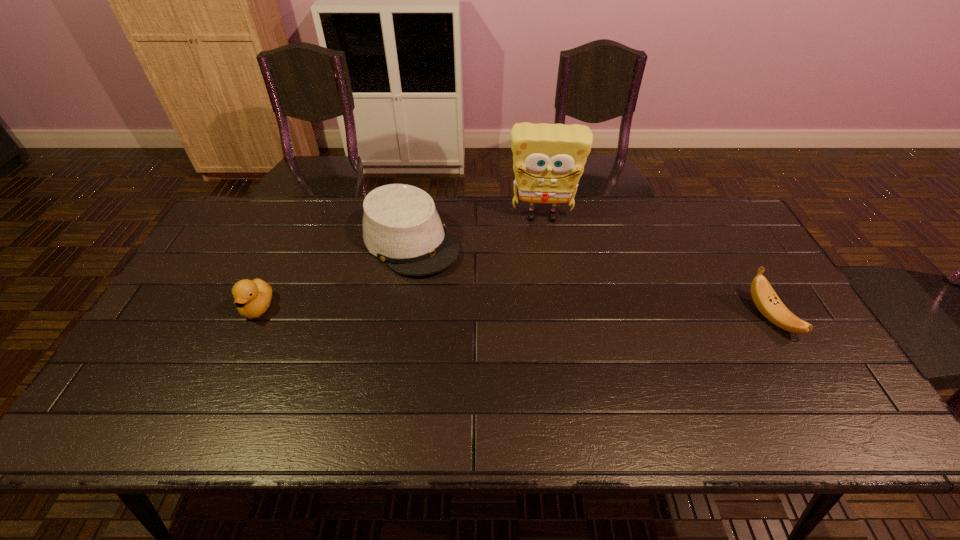
Locate an element on the screen. The width and height of the screenshot is (960, 540). free region at the near left corner of the desktop is located at coordinates (178, 375).

Find the location of a particular element. vacant space at the far right corner of the desktop is located at coordinates (730, 209).

Where is `free space between the hat and the duckling`? This screenshot has width=960, height=540. free space between the hat and the duckling is located at coordinates (334, 275).

I want to click on empty space between the rightmost object and the duckling, so click(x=514, y=313).

This screenshot has width=960, height=540. Identify the location of vacant area that lies between the duckling and the third object from right to left. (334, 275).

You are a GUI agent. You are given a task and a screenshot of the screen. Output one action in this format:
    pyautogui.click(x=<x>, y=<y>)
    Task: Click on the empty space between the third object from right to left and the rightmost object
    This screenshot has height=540, width=960.
    Given the screenshot: What is the action you would take?
    pyautogui.click(x=590, y=280)

Find the location of a particular element. Image resolution: width=960 pixels, height=540 pixels. vacant area between the banana and the second object from left to right is located at coordinates (590, 280).

Locate an element on the screen. vacant point located between the hat and the banana is located at coordinates (590, 280).

I want to click on free point between the rightmost object and the sponge, so click(x=656, y=267).

Where is `free space between the hat and the duckling`? free space between the hat and the duckling is located at coordinates (334, 275).